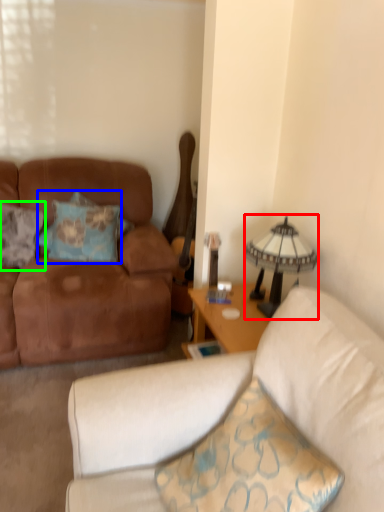
Question: Which object is positioned farthest from lamp (highlighted by a red box)? Select from pillow (highlighted by a blue box) and pillow (highlighted by a green box).

Choices:
 (A) pillow
 (B) pillow

Answer: (B)